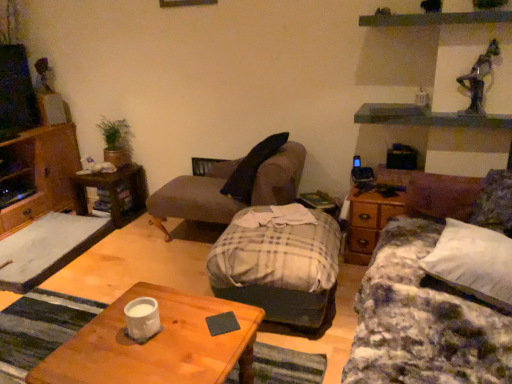
Measure the distance between point (208, 383) and camera.

The depth of point (208, 383) is 4.06 feet.

Describe the element at coordinates (156, 344) in the screenshot. The width and height of the screenshot is (512, 384). I see `wooden coffee table at center` at that location.

What is the approximate width of white soft pillow at right?

It is 13.64 inches.

Find the location of a particular element. The image size is (512, 384). green leafy plant at upper left is located at coordinates (116, 141).

The width and height of the screenshot is (512, 384). What do you see at coordinates (113, 192) in the screenshot? I see `wooden desk at left` at bounding box center [113, 192].

What do you see at coordinates (44, 173) in the screenshot?
I see `wooden cabinet at left` at bounding box center [44, 173].

What do you see at coordinates (142, 318) in the screenshot?
I see `white matte coffee cup at lower left` at bounding box center [142, 318].

At what (x,y) coordinates should I click in order to perform the action: click on plaid fabric studio couch at center, the first studio couch in the right-to-left sequence. Please return your answer as a coordinate pair (x, y). The height and width of the screenshot is (384, 512). Looking at the image, I should click on (423, 319).

How far apart are wooden coffee table at center and wooden cabinet at left?

The distance of wooden coffee table at center from wooden cabinet at left is 6.99 feet.

Is wooden coffee table at center further to camera compared to wooden cabinet at left?

No, it is not.

Between point (263, 316) and point (18, 156), which one is positioned behind?

The point (18, 156) is behind.

From the image's perspective, would you say wooden coffee table at center is shown under wooden cabinet at left?

Yes.

Between green leafy plant at upper left and plush brown chaise at center, which one has larger size?

With larger size is plush brown chaise at center.

You are a GUI agent. You are given a task and a screenshot of the screen. Output one action in this format:
    pyautogui.click(x=<x>, y=<y>)
    Task: Click on the chair in front of the green leafy plant at upper left
    
    Given the screenshot: What is the action you would take?
    pyautogui.click(x=195, y=198)

Between green leafy plant at upper left and plush brown chaise at center, which one has smaller width?

green leafy plant at upper left is thinner.

How much distance is there between green leafy plant at upper left and plush brown chaise at center?

green leafy plant at upper left is 36.43 inches from plush brown chaise at center.

From a real-world perspective, relative to wooden cabinet at left, is wooden desk at left vertically above or below?

wooden desk at left is below wooden cabinet at left.

Considering the positions of objects wooden desk at left and wooden cabinet at left in the image provided, who is more to the left, wooden desk at left or wooden cabinet at left?

wooden cabinet at left.

Is wooden desk at left in front of wooden cabinet at left?

No, it is behind wooden cabinet at left.

Is wooden coffee table at center not close to white matte coffee cup at lower left?

wooden coffee table at center is near white matte coffee cup at lower left, not far away.

Considering the sizes of wooden coffee table at center and white matte coffee cup at lower left in the image, is wooden coffee table at center taller or shorter than white matte coffee cup at lower left?

wooden coffee table at center is taller than white matte coffee cup at lower left.

This screenshot has width=512, height=384. What are the coordinates of `coffee table below the white matte coffee cup at lower left (from a real-world perspective)` in the screenshot? It's located at (156, 344).

From the image's perspective, is wooden desk at left on top of white matte coffee cup at lower left?

Correct, wooden desk at left appears higher than white matte coffee cup at lower left in the image.

Can you tell me how much wooden desk at left and white matte coffee cup at lower left differ in facing direction?

The angle between the facing direction of wooden desk at left and the facing direction of white matte coffee cup at lower left is 94.1 degrees.

Would you say wooden desk at left is outside white matte coffee cup at lower left?

wooden desk at left is positioned outside white matte coffee cup at lower left.

This screenshot has width=512, height=384. Find the location of `desk on the left of the white matte coffee cup at lower left`. desk on the left of the white matte coffee cup at lower left is located at coordinates (113, 192).

From a real-world perspective, between plaid fabric studio couch at center, which is counted as the 2th studio couch, starting from the right, and green leafy plant at upper left, who is vertically lower?

plaid fabric studio couch at center, which is counted as the 2th studio couch, starting from the right, from a real-world perspective.

Would you consider plaid fabric studio couch at center, which is counted as the 2th studio couch, starting from the right, to be distant from green leafy plant at upper left?

Absolutely, plaid fabric studio couch at center, which is counted as the 2th studio couch, starting from the right, is distant from green leafy plant at upper left.

Identify the location of houseplant above the plaid fabric studio couch at center, which is counted as the 2th studio couch, starting from the right (from the image's perspective). (116, 141).

Is plaid fabric studio couch at center, which is the 1th studio couch in left-to-right order, wider than green leafy plant at upper left?

Yes.

From a real-world perspective, which object rests below the other?

In real-world perspective, plaid fabric studio couch at center, marked as the second studio couch in a left-to-right arrangement, is lower.

From the image's perspective, which one is positioned lower, green leafy plant at upper left or plaid fabric studio couch at center, the first studio couch in the right-to-left sequence?

From the image's view, plaid fabric studio couch at center, the first studio couch in the right-to-left sequence, is below.

Looking at this image, could you tell me if green leafy plant at upper left is turned towards plaid fabric studio couch at center, marked as the second studio couch in a left-to-right arrangement?

No, green leafy plant at upper left is not turned towards plaid fabric studio couch at center, marked as the second studio couch in a left-to-right arrangement.

Are green leafy plant at upper left and plaid fabric studio couch at center, the first studio couch in the right-to-left sequence, far apart?

Yes.

Locate an element on the screen. The height and width of the screenshot is (384, 512). cabinetry above the wooden coffee table at center (from the image's perspective) is located at coordinates (44, 173).

You are a GUI agent. You are given a task and a screenshot of the screen. Output one action in this format:
    pyautogui.click(x=<x>, y=<y>)
    Task: Click on the houseplant above the plush brown chaise at center (from a real-world perspective)
    This screenshot has width=512, height=384.
    Given the screenshot: What is the action you would take?
    pyautogui.click(x=116, y=141)

When comparing their distances from plaid fabric studio couch at center, the first studio couch in the right-to-left sequence, does wooden side table at right or plaid fabric studio couch at center, which is counted as the 2th studio couch, starting from the right, seem closer?

plaid fabric studio couch at center, which is counted as the 2th studio couch, starting from the right, is closer to plaid fabric studio couch at center, the first studio couch in the right-to-left sequence.

Looking at the image, which one is located closer to plaid fabric studio couch at center, marked as the second studio couch in a left-to-right arrangement, white matte coffee cup at lower left or white soft pillow at right?

white soft pillow at right is positioned closer to the anchor plaid fabric studio couch at center, marked as the second studio couch in a left-to-right arrangement.

Considering their positions, is wooden desk at left positioned further to plaid fabric studio couch at center, the first studio couch in the right-to-left sequence, than plush brown chaise at center?

Among the two, wooden desk at left is located further to plaid fabric studio couch at center, the first studio couch in the right-to-left sequence.

Looking at the image, which one is located closer to green leafy plant at upper left, wooden cabinet at left or wooden desk at left?

wooden desk at left lies closer to green leafy plant at upper left than the other object.

Estimate the real-world distances between objects in this image. Which object is closer to plush brown chaise at center, white soft pillow at right or wooden side table at right?

wooden side table at right lies closer to plush brown chaise at center than the other object.

Based on their spatial positions, is plaid fabric studio couch at center, which is the 1th studio couch in left-to-right order, or white matte coffee cup at lower left further from wooden cabinet at left?

The object further to wooden cabinet at left is white matte coffee cup at lower left.

Which object lies further to the anchor point wooden desk at left, plush brown chaise at center or white matte coffee cup at lower left?

white matte coffee cup at lower left is positioned further to the anchor wooden desk at left.

Based on their spatial positions, is white soft pillow at right or plaid fabric studio couch at center, the first studio couch in the right-to-left sequence, closer to plush brown chaise at center?

Based on the image, plaid fabric studio couch at center, the first studio couch in the right-to-left sequence, appears to be nearer to plush brown chaise at center.

I want to click on chair between plaid fabric studio couch at center, which is the 1th studio couch in left-to-right order, and green leafy plant at upper left, along the z-axis, so click(x=195, y=198).

In order to click on coffee cup between wooden coffee table at center and wooden cabinet at left in the front-back direction in this screenshot , I will do `click(142, 318)`.

At what (x,y) coordinates should I click in order to perform the action: click on chair located between white matte coffee cup at lower left and wooden desk at left in the depth direction. Please return your answer as a coordinate pair (x, y). This screenshot has width=512, height=384. Looking at the image, I should click on (195, 198).

Locate an element on the screen. The height and width of the screenshot is (384, 512). coffee cup between wooden coffee table at center and wooden desk at left from front to back is located at coordinates (142, 318).